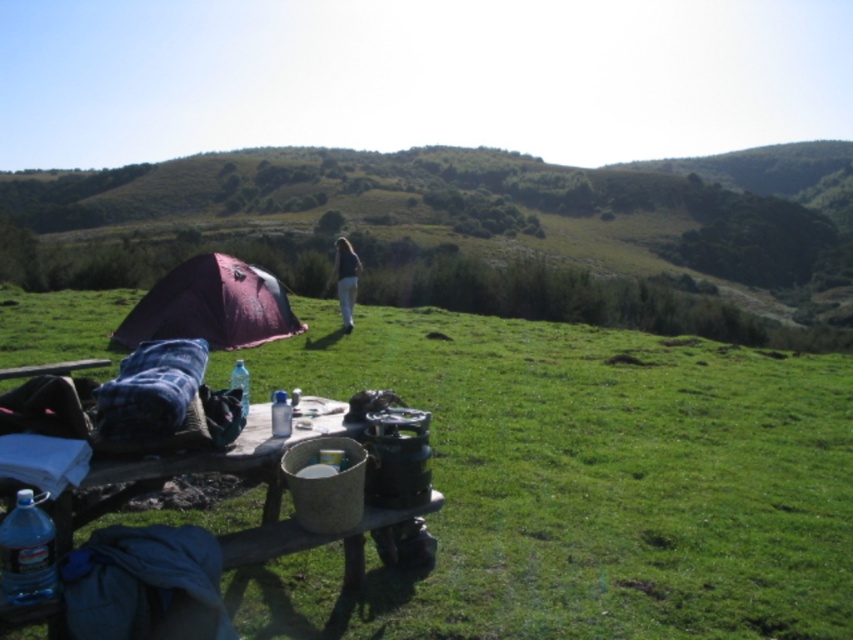
You are standing at the picnic table and want to walk to the red tent. Which direction should you walk relative to the green grassy at center?

Since the green grassy at center is located at point (601,477), you should walk towards it to reach the red tent.